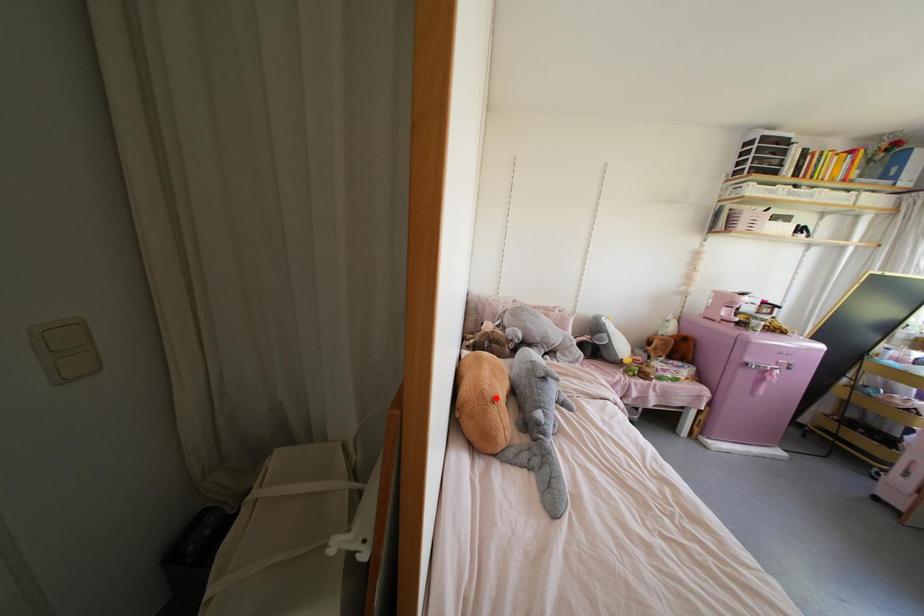
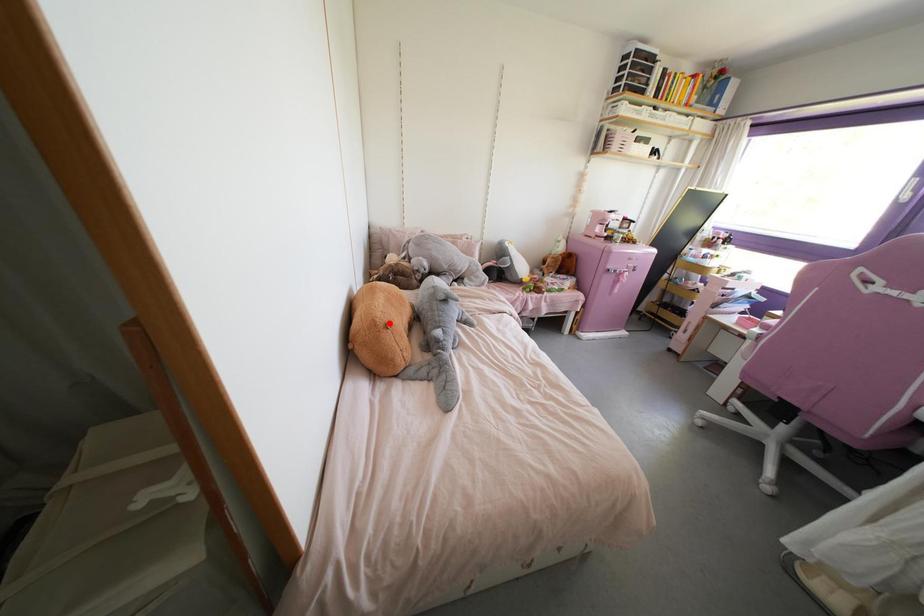
I am providing you with two images of the same scene from different viewpoints. A red point is marked on the first image and another point is marked on the second image. Do the highlighted points in image1 and image2 indicate the same real-world spot?

Yes